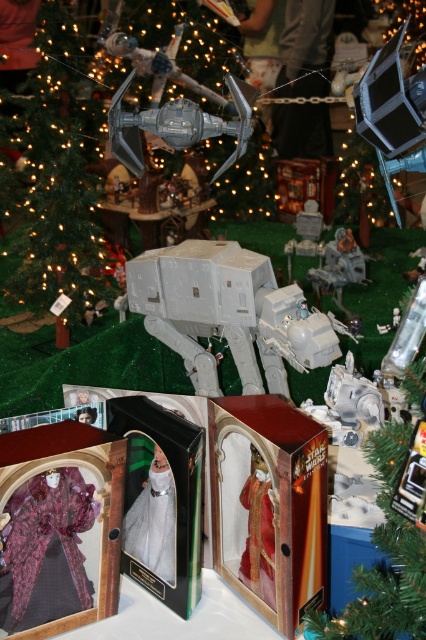
Can you confirm if white matte at-at walker at center is wider than white plastic at-at walker at center?

Yes, white matte at-at walker at center is wider than white plastic at-at walker at center.

Between point (195, 296) and point (325, 282), which one is positioned in front?

Point (195, 296) is more forward.

You are a GUI agent. You are given a task and a screenshot of the screen. Output one action in this format:
    pyautogui.click(x=<x>, y=<y>)
    Task: Click on the white matte at-at walker at center
    The image size is (426, 640).
    Given the screenshot: What is the action you would take?
    pyautogui.click(x=229, y=314)

Is green matte christmas tree at upper left wider than white plastic at-at walker at center?

Correct, the width of green matte christmas tree at upper left exceeds that of white plastic at-at walker at center.

Which is behind, point (40, 13) or point (351, 259)?

The point (40, 13) is more distant.

Is point (66, 28) positioned behind point (347, 236)?

That is True.

Locate an element on the screen. The image size is (426, 640). green matte christmas tree at upper left is located at coordinates (60, 176).

Can you confirm if green matte christmas tree at upper left is positioned above white matte at-at walker at center?

Yes, green matte christmas tree at upper left is above white matte at-at walker at center.

Looking at this image, can you confirm if green matte christmas tree at upper left is thinner than white matte at-at walker at center?

No, green matte christmas tree at upper left is not thinner than white matte at-at walker at center.

Is point (31, 268) in front of point (192, 374)?

No, it is behind (192, 374).

Locate an element on the screen. This screenshot has width=426, height=640. green matte christmas tree at upper left is located at coordinates (60, 176).